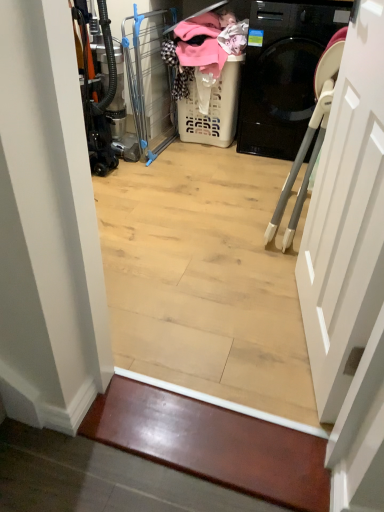
Question: Is white plastic laundry basket at center inside the boundaries of shiny wood stair at lower center, or outside?

Choices:
 (A) outside
 (B) inside

Answer: (A)

Question: From the image's perspective, is white plastic laundry basket at center above or below shiny wood stair at lower center?

Choices:
 (A) below
 (B) above

Answer: (B)

Question: Considering the real-world distances, which object is closest to the clear plastic screen door at center?

Choices:
 (A) white matte door at right
 (B) white plastic laundry basket at center
 (C) shiny wood stair at lower center

Answer: (B)

Question: Which of these objects is positioned farthest from the clear plastic screen door at center?

Choices:
 (A) white matte door at right
 (B) shiny wood stair at lower center
 (C) white plastic laundry basket at center

Answer: (B)